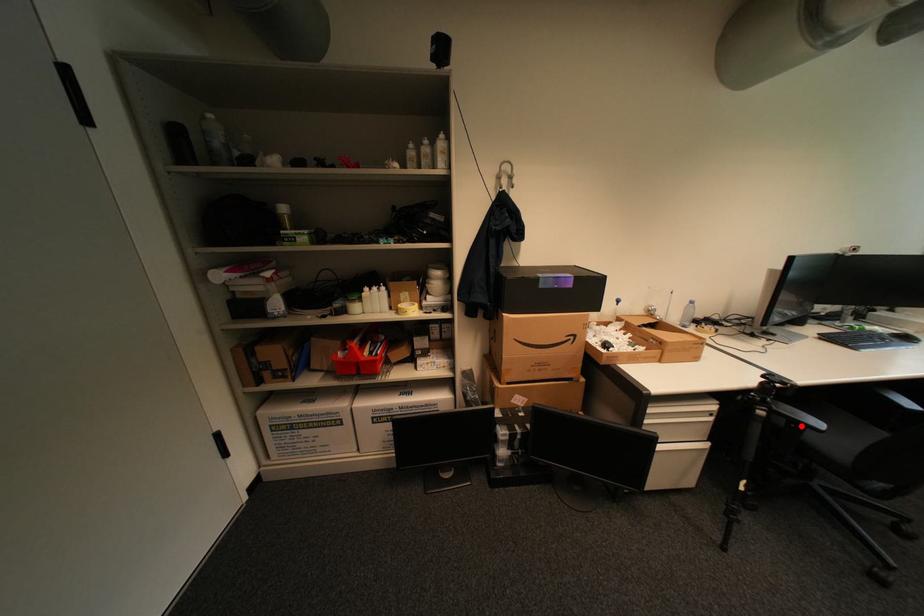
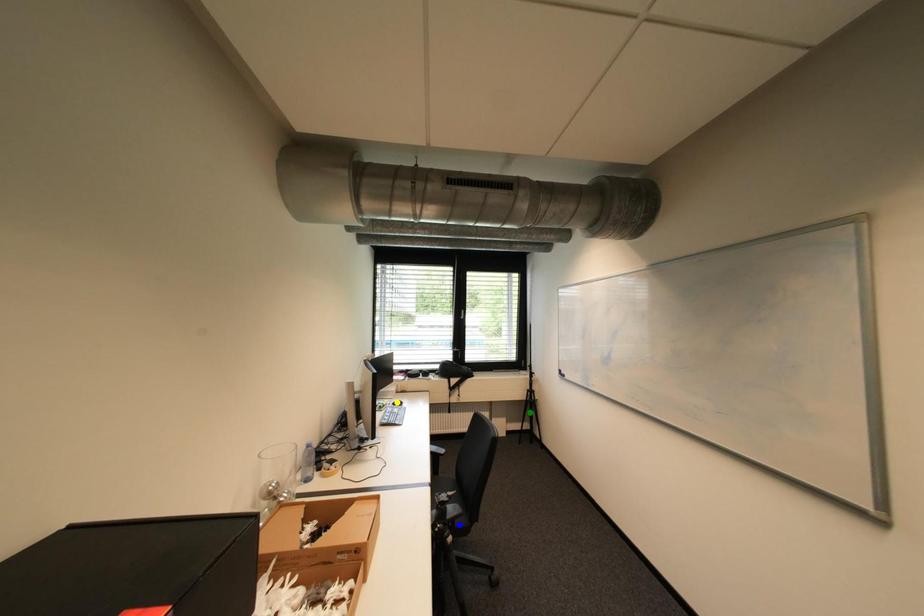
Question: I am providing you with two images of the same scene from different viewpoints. A red point is marked on the first image. You are given multiple points on the second image. Which point in image 2 is actually the same real-world point as the red point in image 1?

Choices:
 (A) blue point
 (B) green point
 (C) yellow point

Answer: (A)